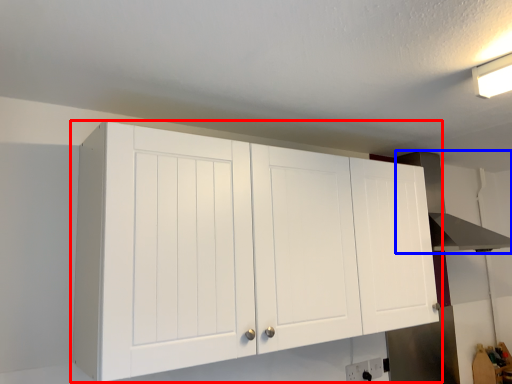
Question: Which object is closer to the camera taking this photo, cupboard (highlighted by a red box) or vent (highlighted by a blue box)?

Choices:
 (A) cupboard
 (B) vent

Answer: (A)